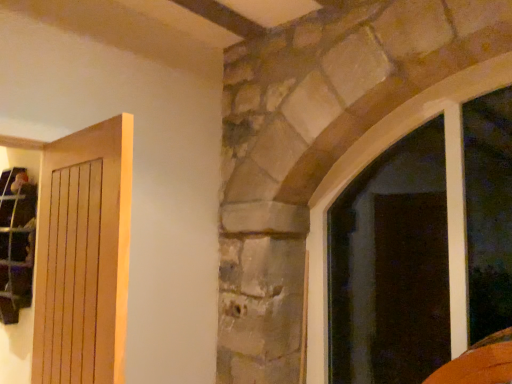
Where is `light brown wood door at left`? The image size is (512, 384). light brown wood door at left is located at coordinates 84,256.

Describe the element at coordinates (84, 256) in the screenshot. I see `light brown wood door at left` at that location.

You are a GUI agent. You are given a task and a screenshot of the screen. Output one action in this format:
    pyautogui.click(x=<x>, y=<y>)
    Task: Click on the light brown wood door at left
    The image size is (512, 384).
    Given the screenshot: What is the action you would take?
    pyautogui.click(x=84, y=256)